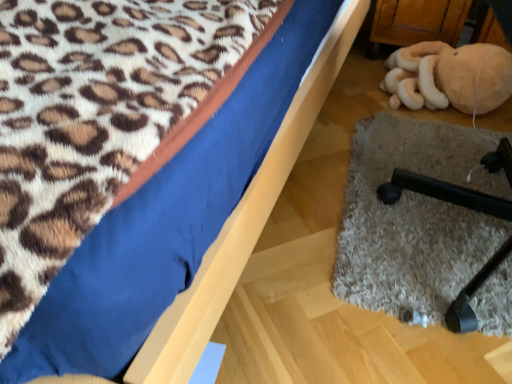
Measure the distance between blue fabric bed at upper left and camera.

blue fabric bed at upper left and camera are 13.27 inches apart from each other.

You are a GUI agent. You are given a task and a screenshot of the screen. Output one action in this format:
    pyautogui.click(x=<x>, y=<y>)
    Task: Click on the beige plush toy at lower right
    
    Given the screenshot: What is the action you would take?
    pyautogui.click(x=449, y=77)

What is the approximate width of beige plush toy at lower right?

The width of beige plush toy at lower right is 17.71 inches.

This screenshot has height=384, width=512. Identify the location of black rubber chair leg at lower right. (443, 194).

From a real-world perspective, does beige plush toy at lower right sit lower than blue fabric bed at upper left?

No, from a real-world perspective, beige plush toy at lower right is not below blue fabric bed at upper left.

Does beige plush toy at lower right appear on the right side of blue fabric bed at upper left?

Correct, you'll find beige plush toy at lower right to the right of blue fabric bed at upper left.

From the picture: From the image's perspective, is beige plush toy at lower right on blue fabric bed at upper left?

Yes, from the image's perspective, beige plush toy at lower right is above blue fabric bed at upper left.

Is beige plush toy at lower right inside or outside of blue fabric bed at upper left?

beige plush toy at lower right lies outside blue fabric bed at upper left.

Based on the photo, considering the sizes of objects blue fabric bed at upper left and black rubber chair leg at lower right in the image provided, who is thinner, blue fabric bed at upper left or black rubber chair leg at lower right?

With smaller width is black rubber chair leg at lower right.

Is blue fabric bed at upper left next to black rubber chair leg at lower right and touching it?

blue fabric bed at upper left and black rubber chair leg at lower right are clearly separated.

From a real-world perspective, is beige plush toy at lower right on top of black rubber chair leg at lower right?

Indeed, from a real-world perspective, beige plush toy at lower right stands above black rubber chair leg at lower right.

Does beige plush toy at lower right touch black rubber chair leg at lower right?

No, beige plush toy at lower right is not beside black rubber chair leg at lower right.

From the image's perspective, is beige plush toy at lower right located above or below black rubber chair leg at lower right?

Based on their image positions, beige plush toy at lower right is located above black rubber chair leg at lower right.

Which is more to the right, beige plush toy at lower right or black rubber chair leg at lower right?

Positioned to the right is beige plush toy at lower right.

Between black rubber chair leg at lower right and beige plush toy at lower right, which one has smaller width?

Thinner between the two is beige plush toy at lower right.

Which point is more forward, (382, 193) or (478, 51)?

The point (382, 193) is in front.

Is black rubber chair leg at lower right facing towards beige plush toy at lower right?

No, black rubber chair leg at lower right is not aimed at beige plush toy at lower right.

Would you consider black rubber chair leg at lower right to be distant from beige plush toy at lower right?

No, black rubber chair leg at lower right is not far away from beige plush toy at lower right.

Is blue fabric bed at upper left thinner than beige plush toy at lower right?

No, blue fabric bed at upper left is not thinner than beige plush toy at lower right.

Measure the distance between blue fabric bed at upper left and beige plush toy at lower right.

blue fabric bed at upper left is 25.20 inches away from beige plush toy at lower right.

Could you tell me if blue fabric bed at upper left is turned towards beige plush toy at lower right?

No.

Locate an element on the screen. toy on the right of blue fabric bed at upper left is located at coordinates (449, 77).

Is blue fabric bed at upper left a part of black rubber chair leg at lower right?

Actually, blue fabric bed at upper left is outside black rubber chair leg at lower right.

In order to click on furniture lying behind the blue fabric bed at upper left in this screenshot , I will do `click(443, 194)`.

Is point (435, 181) farther from viewer compared to point (139, 336)?

Yes, it is behind point (139, 336).

Is black rubber chair leg at lower right wider or thinner than blue fabric bed at upper left?

black rubber chair leg at lower right is thinner than blue fabric bed at upper left.

Identify the location of bed in front of the beige plush toy at lower right. This screenshot has height=384, width=512. (244, 215).

Identify the location of furniture behind the blue fabric bed at upper left. (443, 194).

From the image, which object appears to be farther from blue fabric bed at upper left, black rubber chair leg at lower right or beige plush toy at lower right?

Based on the image, beige plush toy at lower right appears to be further to blue fabric bed at upper left.

From the picture: Considering their positions, is black rubber chair leg at lower right positioned closer to beige plush toy at lower right than blue fabric bed at upper left?

Among the two, black rubber chair leg at lower right is located nearer to beige plush toy at lower right.

Estimate the real-world distances between objects in this image. Which object is further from beige plush toy at lower right, blue fabric bed at upper left or black rubber chair leg at lower right?

blue fabric bed at upper left.

Which object lies further to the anchor point black rubber chair leg at lower right, blue fabric bed at upper left or beige plush toy at lower right?

blue fabric bed at upper left lies further to black rubber chair leg at lower right than the other object.

From the picture: Based on their spatial positions, is beige plush toy at lower right or black rubber chair leg at lower right further from blue fabric bed at upper left?

beige plush toy at lower right is further to blue fabric bed at upper left.

When comparing their distances from black rubber chair leg at lower right, does beige plush toy at lower right or blue fabric bed at upper left seem further?

The object further to black rubber chair leg at lower right is blue fabric bed at upper left.

You are a GUI agent. You are given a task and a screenshot of the screen. Output one action in this format:
    pyautogui.click(x=<x>, y=<y>)
    Task: Click on the furniture between blue fabric bed at upper left and beige plush toy at lower right in the front-back direction
    
    Given the screenshot: What is the action you would take?
    pyautogui.click(x=443, y=194)